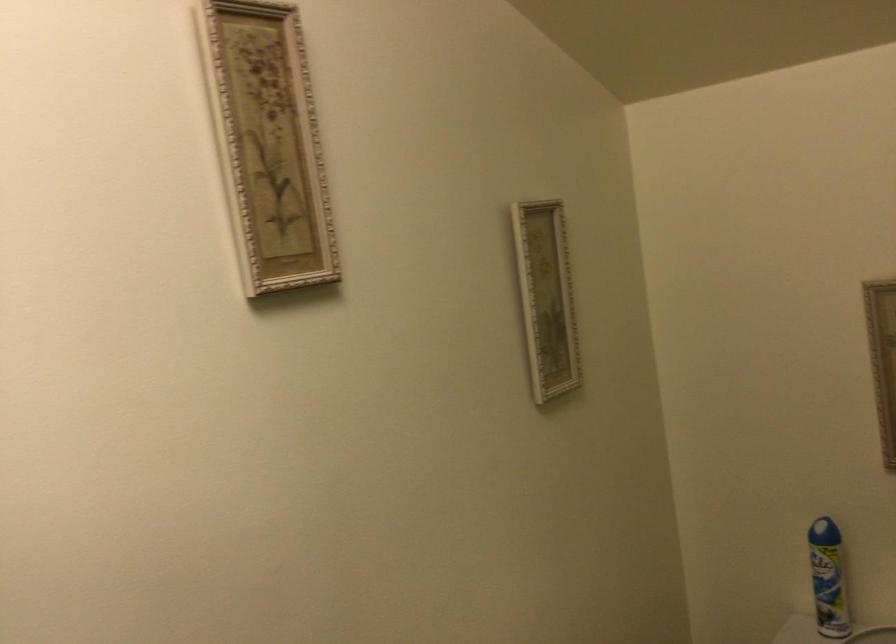
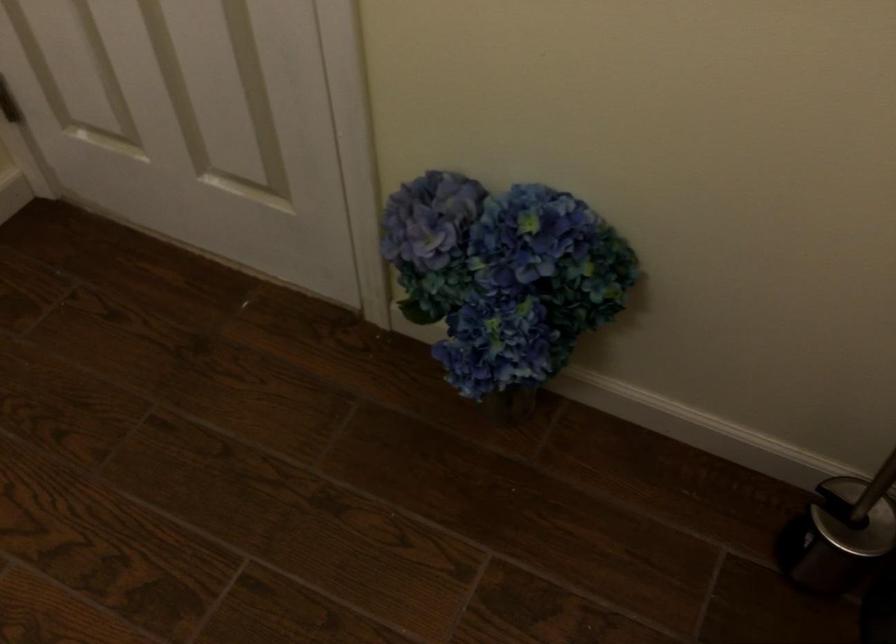
Based on the continuous images, in which direction is the camera rotating?

The camera's rotation is toward left-down.